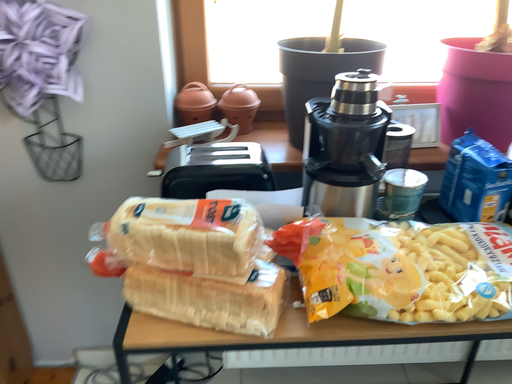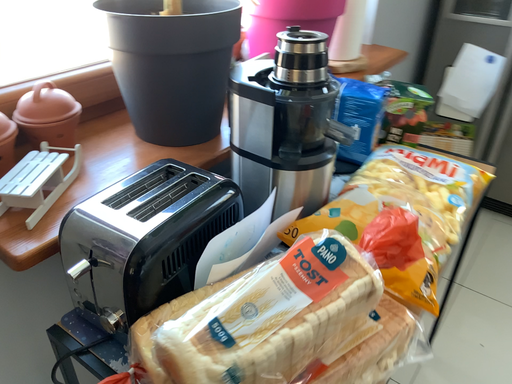
Question: Which way did the camera rotate in the video?

Choices:
 (A) rotated right
 (B) rotated left

Answer: (A)